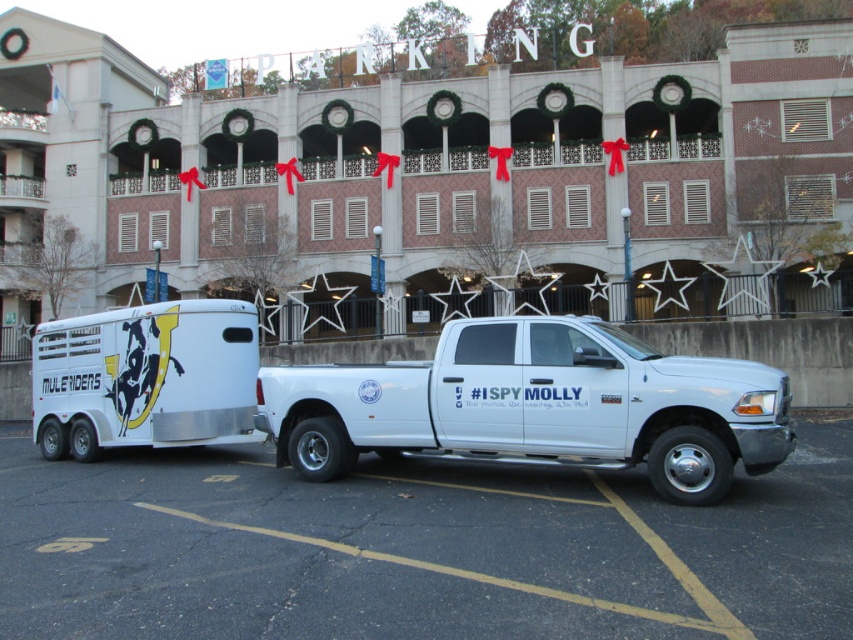
Does white smooth asphalt at lower center come behind metallic silver horse trailer at center?

No, it is in front of metallic silver horse trailer at center.

Is point (422, 540) positioned behind point (229, 304)?

No, it is in front of (229, 304).

Is point (206, 477) behind point (44, 454)?

No, (206, 477) is closer to viewer.

Where is `white smooth asphalt at lower center`? Image resolution: width=853 pixels, height=640 pixels. white smooth asphalt at lower center is located at coordinates (416, 548).

Which is above, white smooth asphalt at lower center or white matte truck at center?

Positioned higher is white matte truck at center.

Measure the distance between white smooth asphalt at lower center and camera.

They are 4.01 meters apart.

Who is more forward, [793,602] or [305,392]?

Point [793,602] is more forward.

This screenshot has height=640, width=853. What are the coordinates of `white smooth asphalt at lower center` in the screenshot? It's located at pos(416,548).

Can you confirm if white matte truck at center is taller than metallic silver horse trailer at center?

No.

Is white matte truck at center below metallic silver horse trailer at center?

No.

What do you see at coordinates (537, 404) in the screenshot?
I see `white matte truck at center` at bounding box center [537, 404].

The image size is (853, 640). What are the coordinates of `white matte truck at center` in the screenshot? It's located at (537, 404).